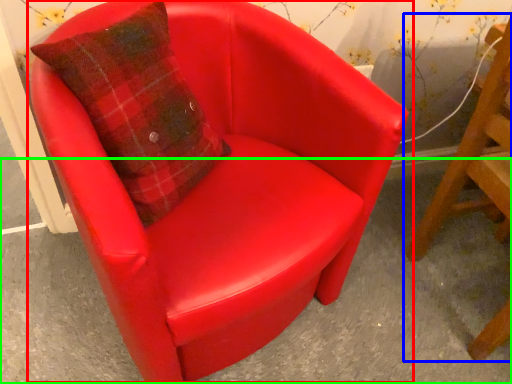
Question: Which object is positioned farthest from chair (highlighted by a red box)? Select from chair (highlighted by a blue box) and concrete (highlighted by a green box).

Choices:
 (A) chair
 (B) concrete

Answer: (A)